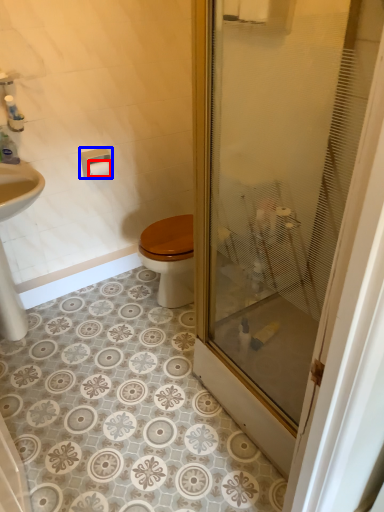
Question: Which point is further to the camera, toilet paper (highlighted by a red box) or towel bar (highlighted by a blue box)?

Choices:
 (A) toilet paper
 (B) towel bar

Answer: (A)